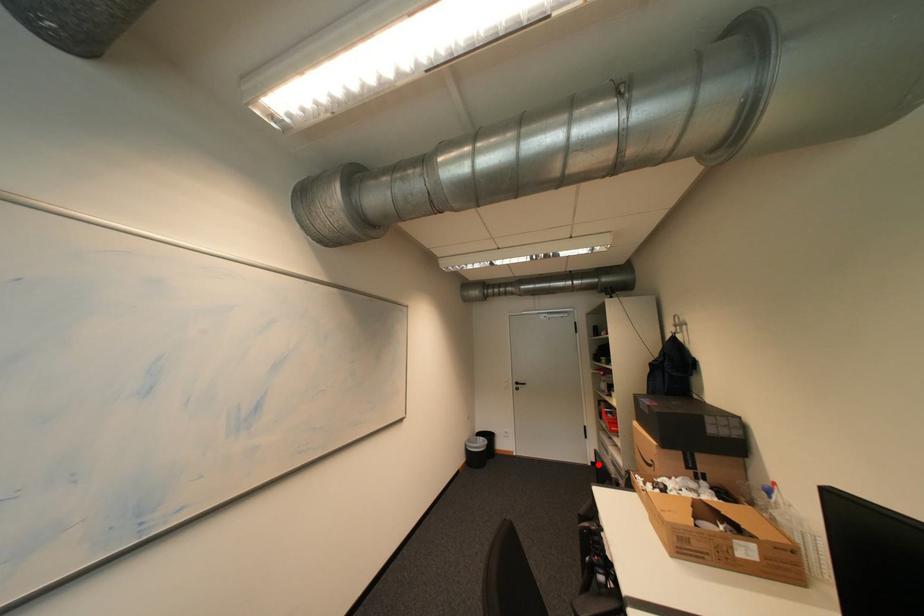
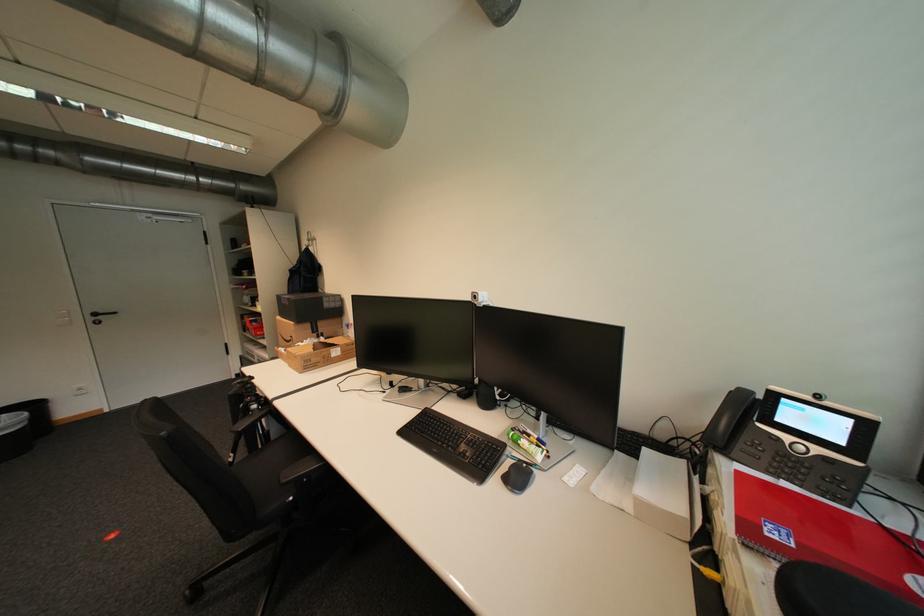
Where in the second image is the point corresponding to the highlighted location from the first image?

(242, 378)